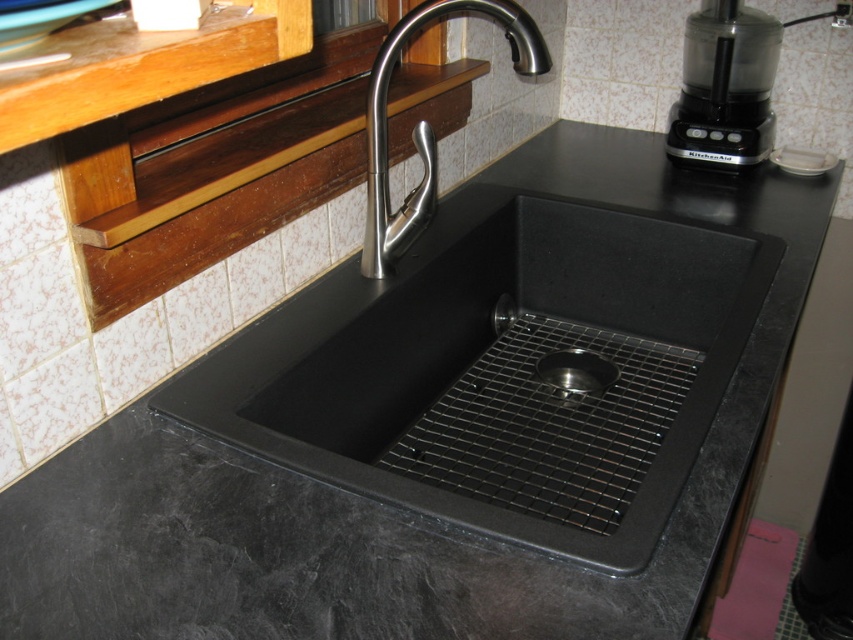
Who is more forward, (708, 122) or (573, 349)?

Point (573, 349)

The image size is (853, 640). What are the coordinates of `black plastic food processor at upper right` in the screenshot? It's located at (724, 86).

The image size is (853, 640). In order to click on black plastic food processor at upper right in this screenshot , I will do `click(724, 86)`.

Who is lower down, black plastic food processor at upper right or satin nickel faucet at center?

Positioned lower is satin nickel faucet at center.

Between black plastic food processor at upper right and satin nickel faucet at center, which one has less height?

black plastic food processor at upper right

Who is more forward, (729, 68) or (392, 68)?

Positioned in front is point (392, 68).

In order to click on black plastic food processor at upper right in this screenshot , I will do `click(724, 86)`.

Looking at this image, can you confirm if satin nickel faucet at center is smaller than metallic silver drain at center?

No.

Does satin nickel faucet at center have a larger size compared to metallic silver drain at center?

Yes, satin nickel faucet at center is bigger than metallic silver drain at center.

Describe the element at coordinates (424, 125) in the screenshot. I see `satin nickel faucet at center` at that location.

Where is `satin nickel faucet at center`? The width and height of the screenshot is (853, 640). satin nickel faucet at center is located at coordinates (424, 125).